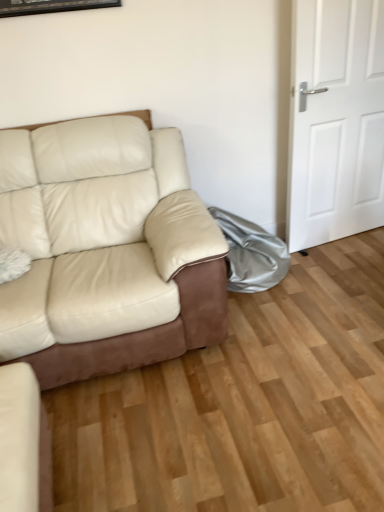
Question: Can you confirm if white matte door at right is bigger than beige leather couch at left, marked as the first studio couch in a top-to-bottom arrangement?

Choices:
 (A) no
 (B) yes

Answer: (A)

Question: Could beige leather couch at left, marked as the 2th studio couch in a bottom-to-top arrangement, be considered to be inside white matte door at right?

Choices:
 (A) yes
 (B) no

Answer: (B)

Question: Would you say white matte door at right is a long distance from beige leather couch at left, marked as the 2th studio couch in a bottom-to-top arrangement?

Choices:
 (A) no
 (B) yes

Answer: (B)

Question: From the image's perspective, does white matte door at right appear higher than beige leather couch at left, marked as the 2th studio couch in a bottom-to-top arrangement?

Choices:
 (A) no
 (B) yes

Answer: (B)

Question: From a real-world perspective, is white matte door at right physically above beige leather couch at left, marked as the first studio couch in a top-to-bottom arrangement?

Choices:
 (A) yes
 (B) no

Answer: (A)

Question: Does white matte door at right have a lesser height compared to beige leather couch at left, marked as the 2th studio couch in a bottom-to-top arrangement?

Choices:
 (A) yes
 (B) no

Answer: (B)

Question: Can we say beige leather couch at left, marked as the 2th studio couch in a bottom-to-top arrangement, lies outside leather couch at lower left, positioned as the second studio couch in top-to-bottom order?

Choices:
 (A) yes
 (B) no

Answer: (A)

Question: Is beige leather couch at left, marked as the 2th studio couch in a bottom-to-top arrangement, wider than leather couch at lower left, positioned as the first studio couch in bottom-to-top order?

Choices:
 (A) no
 (B) yes

Answer: (B)

Question: From a real-world perspective, is beige leather couch at left, marked as the first studio couch in a top-to-bottom arrangement, under leather couch at lower left, positioned as the second studio couch in top-to-bottom order?

Choices:
 (A) no
 (B) yes

Answer: (A)

Question: Is beige leather couch at left, marked as the first studio couch in a top-to-bottom arrangement, not near leather couch at lower left, positioned as the first studio couch in bottom-to-top order?

Choices:
 (A) yes
 (B) no

Answer: (B)

Question: From the image's perspective, is beige leather couch at left, marked as the first studio couch in a top-to-bottom arrangement, above leather couch at lower left, positioned as the first studio couch in bottom-to-top order?

Choices:
 (A) no
 (B) yes

Answer: (B)

Question: Is beige leather couch at left, marked as the first studio couch in a top-to-bottom arrangement, taller than leather couch at lower left, positioned as the first studio couch in bottom-to-top order?

Choices:
 (A) yes
 (B) no

Answer: (A)

Question: Does leather couch at lower left, positioned as the first studio couch in bottom-to-top order, lie in front of silver metallic bag at lower right?

Choices:
 (A) yes
 (B) no

Answer: (A)